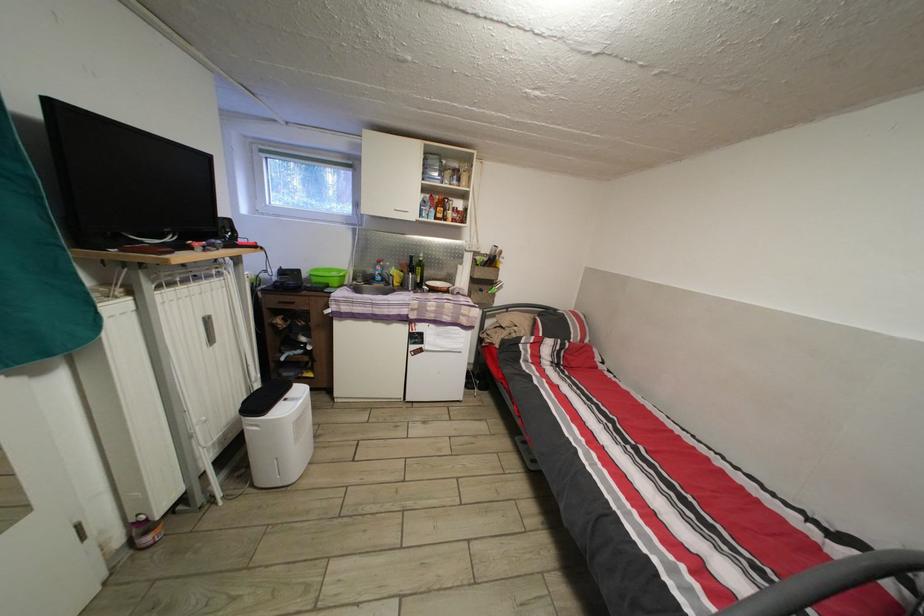
Locate an element on the screen. The height and width of the screenshot is (616, 924). small purple bottle is located at coordinates (144, 531).